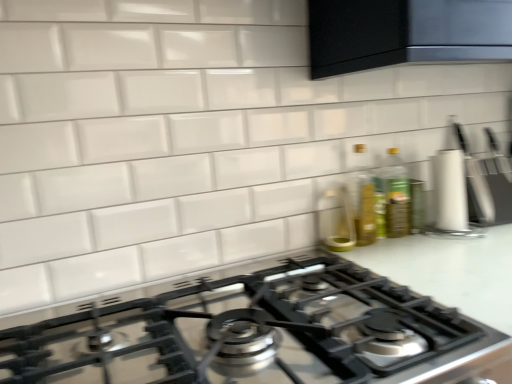
Question: From the image's perspective, is clear glass bottle at center located above or below green glass bottle at upper right, which ranks as the second bottle in left-to-right order?

Choices:
 (A) below
 (B) above

Answer: (A)

Question: Does point pos(324,233) appear closer or farther from the camera than point pos(407,226)?

Choices:
 (A) farther
 (B) closer

Answer: (B)

Question: Based on their relative distances, which object is farther from the white matte knife block at right?

Choices:
 (A) translucent glass bottle at right, placed as the 1th bottle when sorted from left to right
 (B) white glossy countertop at center
 (C) satin black gas stove at center
 (D) clear glass bottle at center
 (E) green glass bottle at upper right, which is counted as the 1th bottle, starting from the right

Answer: (C)

Question: Which of these objects is positioned farthest from the satin black gas stove at center?

Choices:
 (A) green glass bottle at upper right, which is counted as the 1th bottle, starting from the right
 (B) white matte knife block at right
 (C) white glossy countertop at center
 (D) clear glass bottle at center
 (E) translucent glass bottle at right, placed as the 2th bottle when sorted from right to left

Answer: (B)